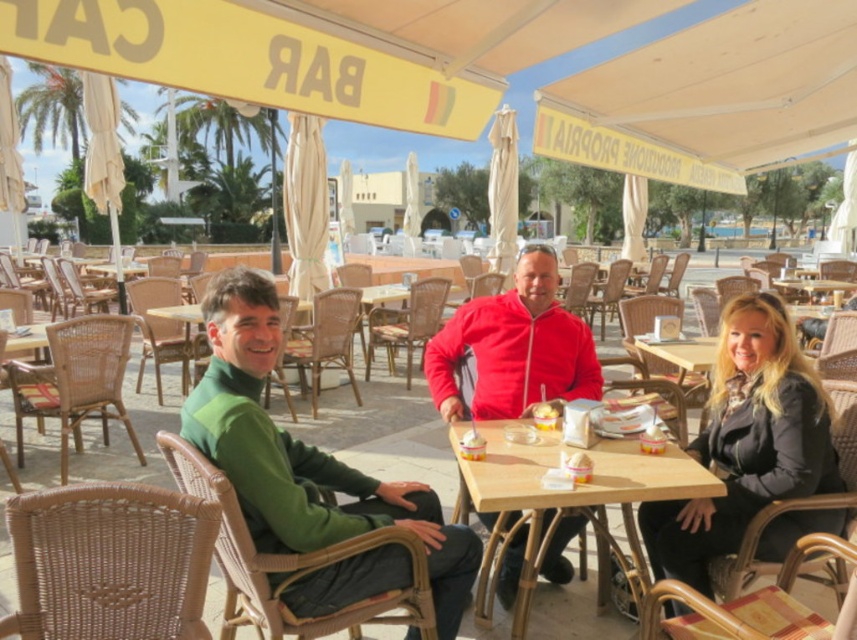
You are planning to place a large decorative plate that requires 1.2 meters of space on the wooden table at center. Considering the velvet red jacket at center is currently on the table, can the plate fit?

The velvet red jacket at center has a width less than the wooden table at center, but the exact dimensions are not provided. However, since the jacket is smaller than the table, there might be enough space for the plate if positioned correctly. However, without knowing the table size, it is uncertain.

You are a photographer trying to capture the perfect shot of the green woven sweater at center. The camera has a focus point at coordinates 0.713, 0.355. Is the sweater positioned correctly to be in focus?

Yes, the green woven sweater at center is located exactly at the focus point coordinates [303,456], so it will be in focus.